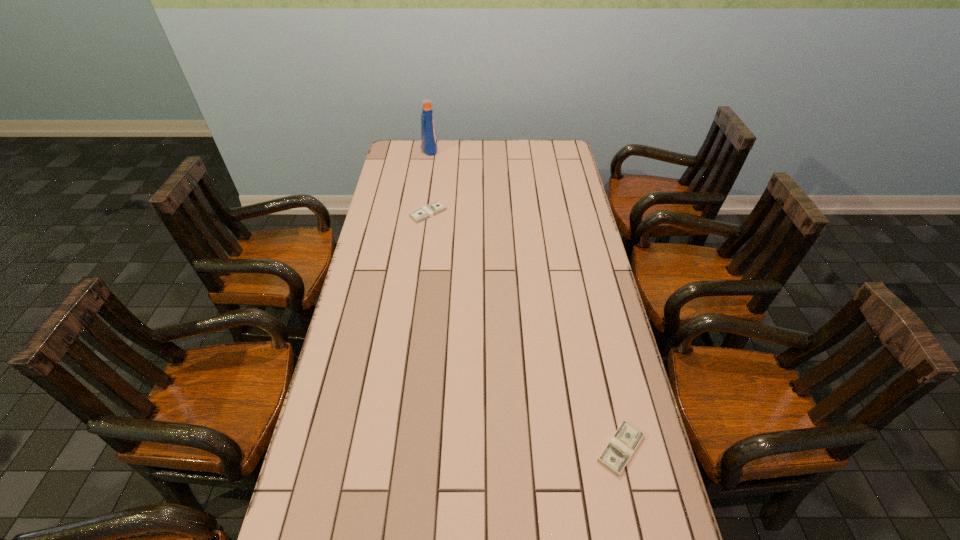
Where is `vacant area between the farther dollar and the detergent`? The image size is (960, 540). vacant area between the farther dollar and the detergent is located at coordinates (429, 181).

Identify the location of unoccupied position between the tallest object and the right dollar. (525, 299).

Identify the location of free space between the rightmost object and the left dollar. (524, 330).

The width and height of the screenshot is (960, 540). Find the location of `free space between the farther dollar and the rightmost object`. free space between the farther dollar and the rightmost object is located at coordinates (524, 330).

Where is `vacant area that lies between the nearest object and the left dollar`? vacant area that lies between the nearest object and the left dollar is located at coordinates (524, 330).

At what (x,y) coordinates should I click in order to perform the action: click on empty space between the right dollar and the left dollar. Please return your answer as a coordinate pair (x, y). This screenshot has height=540, width=960. Looking at the image, I should click on (524, 330).

The height and width of the screenshot is (540, 960). I want to click on blank region between the detergent and the second farthest object, so click(x=429, y=181).

Where is `unoccupied position between the nearer dollar and the farther dollar`? Image resolution: width=960 pixels, height=540 pixels. unoccupied position between the nearer dollar and the farther dollar is located at coordinates (524, 330).

Locate an element on the screen. vacant area that lies between the left dollar and the detergent is located at coordinates (429, 181).

Where is `object that is the second nearest to the left dollar`? The image size is (960, 540). object that is the second nearest to the left dollar is located at coordinates (623, 443).